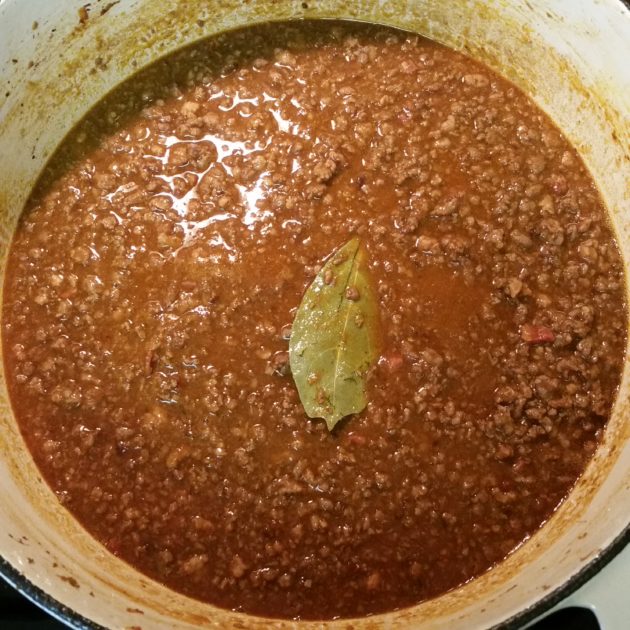
Where is `stain on side of bowl`? This screenshot has height=630, width=630. stain on side of bowl is located at coordinates (176, 12).